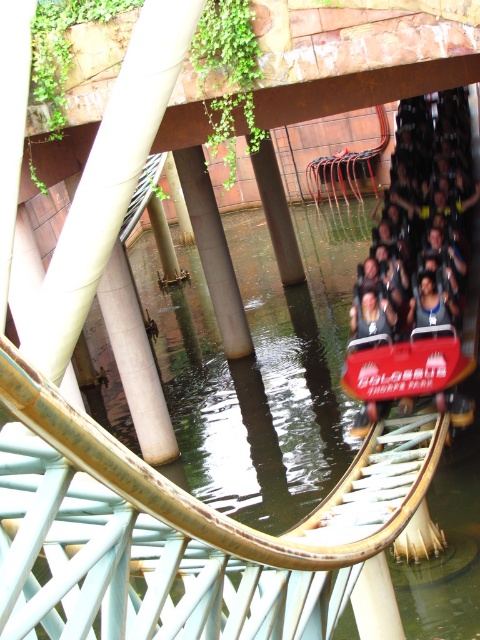
Question: Which object appears farthest from the camera in this image?

Choices:
 (A) brown concrete pillar at center
 (B) matte red roller coaster car at center
 (C) concrete pillar at center

Answer: (A)

Question: Does matte red roller coaster car at center appear on the right side of brown concrete pillar at center?

Choices:
 (A) no
 (B) yes

Answer: (B)

Question: Can you confirm if matte red roller coaster car at center is positioned below brown concrete pillar at center?

Choices:
 (A) no
 (B) yes

Answer: (A)

Question: Among these points, which one is farthest from the camera?

Choices:
 (A) (432, 388)
 (B) (273, 218)

Answer: (B)

Question: Which of the following is the farthest from the observer?

Choices:
 (A) coord(204,228)
 (B) coord(358,316)

Answer: (A)

Question: Is brown concrete pillar at center wider than concrete pillar at center?

Choices:
 (A) no
 (B) yes

Answer: (B)